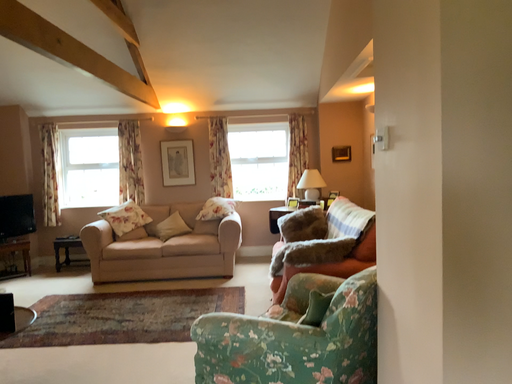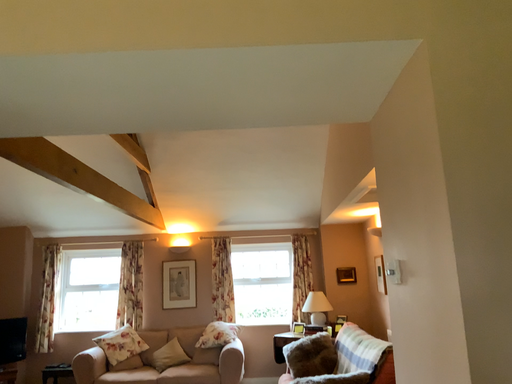
Question: Which way did the camera rotate in the video?

Choices:
 (A) rotated downward
 (B) rotated upward

Answer: (B)